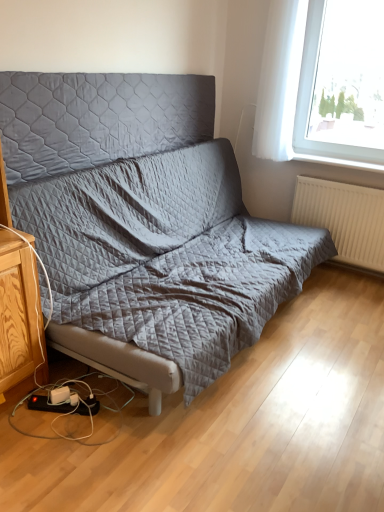
Question: Considering the relative positions of quilted fabric headboard at upper center and quilted fabric studio couch at center in the image provided, is quilted fabric headboard at upper center to the left of quilted fabric studio couch at center from the viewer's perspective?

Choices:
 (A) no
 (B) yes

Answer: (B)

Question: From the image's perspective, is quilted fabric headboard at upper center above quilted fabric studio couch at center?

Choices:
 (A) no
 (B) yes

Answer: (B)

Question: From a real-world perspective, is quilted fabric headboard at upper center under quilted fabric studio couch at center?

Choices:
 (A) yes
 (B) no

Answer: (B)

Question: Is quilted fabric headboard at upper center closer to camera compared to quilted fabric studio couch at center?

Choices:
 (A) yes
 (B) no

Answer: (B)

Question: Is the depth of quilted fabric headboard at upper center greater than that of quilted fabric studio couch at center?

Choices:
 (A) yes
 (B) no

Answer: (A)

Question: In the image, is white sheer curtain at upper right on the left side or the right side of black plastic power strip at lower left?

Choices:
 (A) left
 (B) right

Answer: (B)

Question: Would you say white sheer curtain at upper right is inside or outside black plastic power strip at lower left?

Choices:
 (A) inside
 (B) outside

Answer: (B)

Question: In terms of width, does white sheer curtain at upper right look wider or thinner when compared to black plastic power strip at lower left?

Choices:
 (A) thin
 (B) wide

Answer: (A)

Question: From a real-world perspective, is white sheer curtain at upper right physically located above or below black plastic power strip at lower left?

Choices:
 (A) above
 (B) below

Answer: (A)

Question: In the image, is quilted fabric studio couch at center positioned in front of or behind black plastic power strip at lower left?

Choices:
 (A) front
 (B) behind

Answer: (A)

Question: Considering the positions of point (97, 81) and point (28, 403), is point (97, 81) closer or farther from the camera than point (28, 403)?

Choices:
 (A) farther
 (B) closer

Answer: (A)

Question: In terms of width, does quilted fabric studio couch at center look wider or thinner when compared to black plastic power strip at lower left?

Choices:
 (A) thin
 (B) wide

Answer: (B)

Question: Is quilted fabric studio couch at center inside the boundaries of black plastic power strip at lower left, or outside?

Choices:
 (A) inside
 (B) outside

Answer: (B)

Question: Would you say black plastic power strip at lower left is to the left or to the right of transparent glass window at upper right in the picture?

Choices:
 (A) right
 (B) left

Answer: (B)

Question: Does point (61, 403) appear closer or farther from the camera than point (284, 23)?

Choices:
 (A) closer
 (B) farther

Answer: (A)